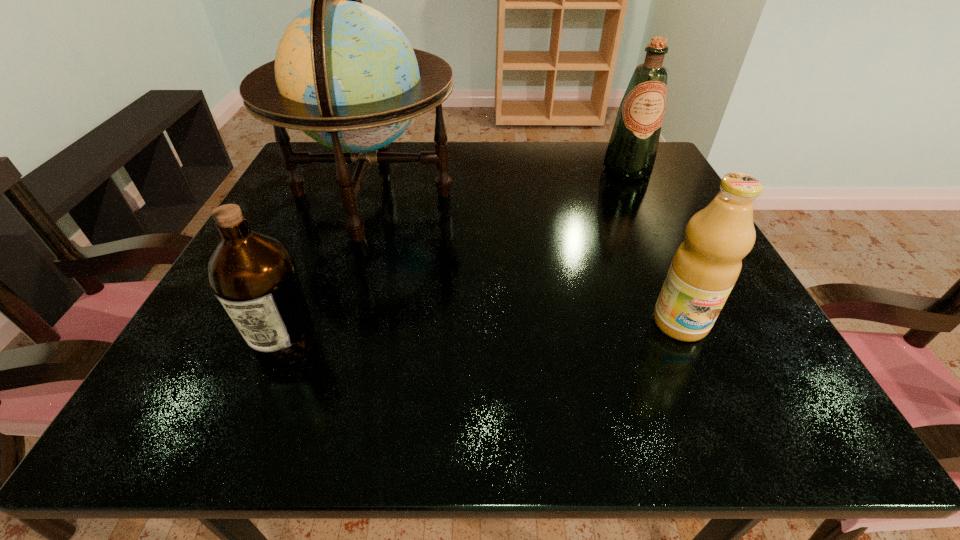
You are a GUI agent. You are given a task and a screenshot of the screen. Output one action in this format:
    pyautogui.click(x=<x>, y=<y>)
    Task: Click on the tallest object
    
    Given the screenshot: What is the action you would take?
    pyautogui.click(x=345, y=74)

What are the coordinates of `the farthest olive oil` in the screenshot? It's located at (632, 149).

Locate an element on the screen. This screenshot has height=540, width=960. the leftmost olive oil is located at coordinates (254, 276).

Where is `free region located on the surface of the tallest object`? free region located on the surface of the tallest object is located at coordinates (562, 194).

You are a GUI agent. You are given a task and a screenshot of the screen. Output one action in this format:
    pyautogui.click(x=<x>, y=<y>)
    Task: Click on the free space located 0.130m on the front-facing side of the farthest olive oil
    This screenshot has height=540, width=960.
    Given the screenshot: What is the action you would take?
    pyautogui.click(x=650, y=215)

At what (x,y) coordinates should I click in order to perform the action: click on vacant region located 0.060m on the label of the leftmost olive oil. Please return your answer as a coordinate pair (x, y). The height and width of the screenshot is (540, 960). Looking at the image, I should click on (259, 409).

Locate an element on the screen. This screenshot has height=540, width=960. globe located in the far edge section of the desktop is located at coordinates (345, 74).

This screenshot has height=540, width=960. What are the coordinates of `olive oil located in the far edge section of the desktop` in the screenshot? It's located at (632, 149).

What are the coordinates of `globe positioned at the left edge` in the screenshot? It's located at (345, 74).

At what (x,y) coordinates should I click in order to perform the action: click on olive oil situated at the left edge. Please return your answer as a coordinate pair (x, y). The height and width of the screenshot is (540, 960). Looking at the image, I should click on (254, 276).